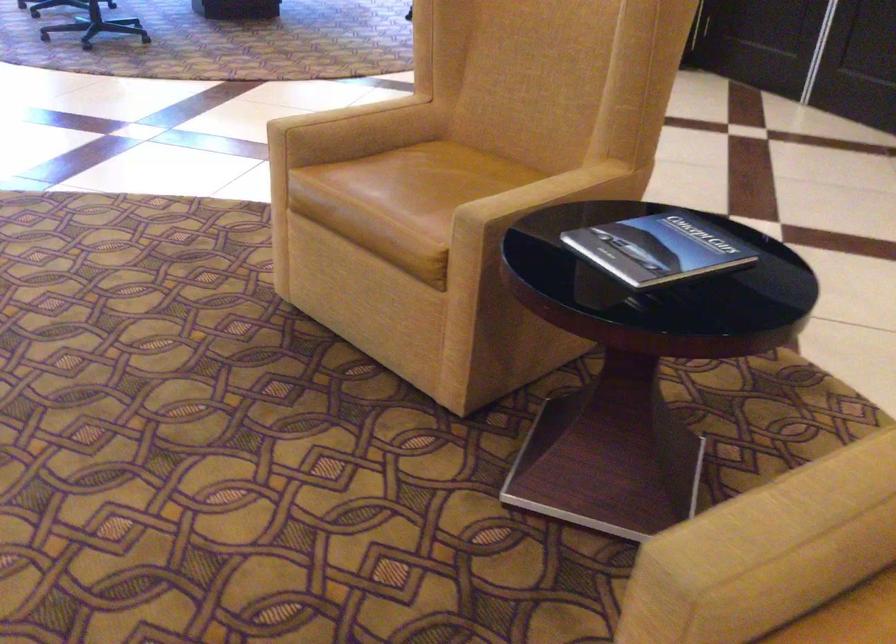
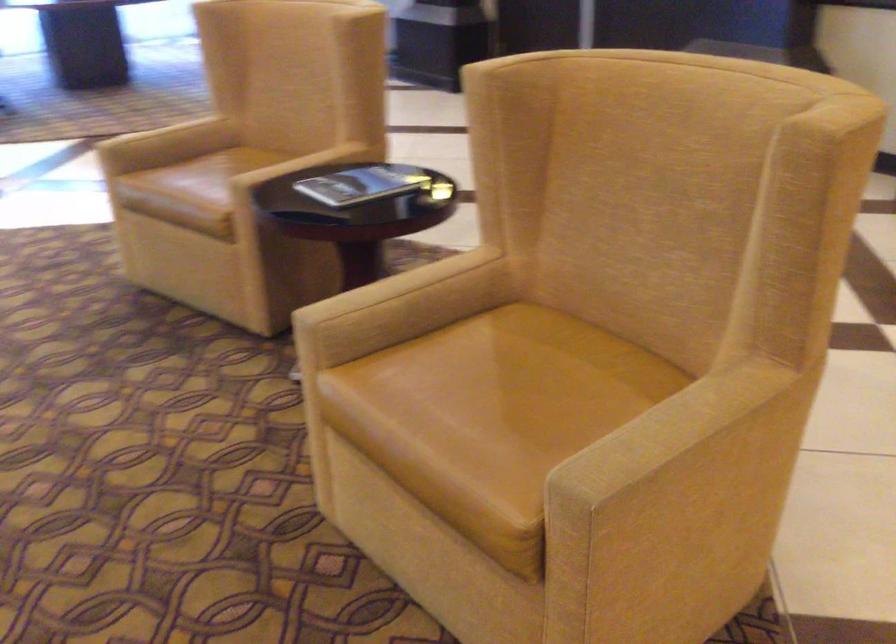
Based on the photo, which direction would the cameraman need to move to produce the second image?

The cameraman moved toward right, backward.